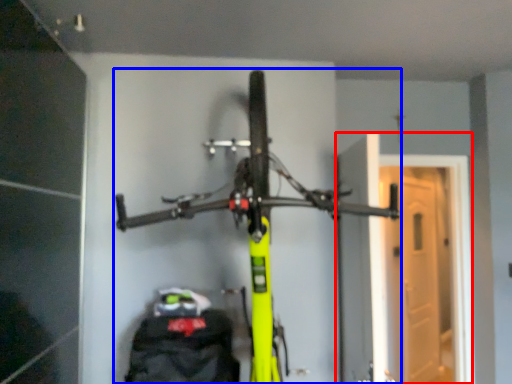
Question: Which object is closer to the camera taking this photo, garage door (highlighted by a red box) or bicycle (highlighted by a blue box)?

Choices:
 (A) garage door
 (B) bicycle

Answer: (B)